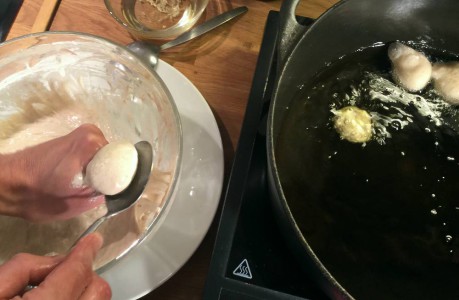
The width and height of the screenshot is (459, 300). I want to click on brown wood table surface, so click(228, 78).